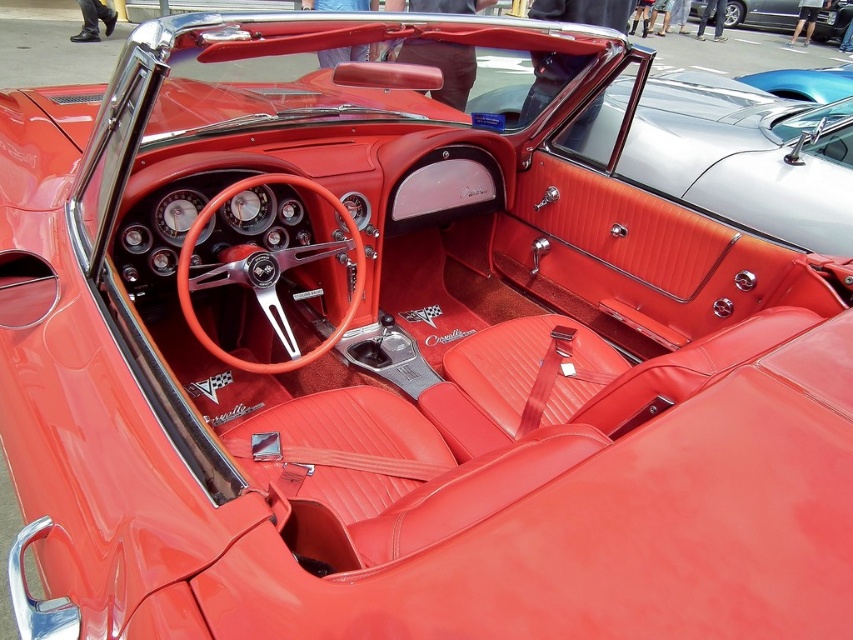
Question: Is matte red leather door at center closer to camera compared to glossy red leather convertible at upper center?

Choices:
 (A) no
 (B) yes

Answer: (B)

Question: Is matte red leather door at center below glossy red leather convertible at upper center?

Choices:
 (A) no
 (B) yes

Answer: (B)

Question: Which of the following is the closest to the observer?

Choices:
 (A) (849, 179)
 (B) (816, 29)

Answer: (A)

Question: Does matte red leather door at center lie behind glossy red leather convertible at upper center?

Choices:
 (A) no
 (B) yes

Answer: (A)

Question: Which object is closer to the camera taking this photo?

Choices:
 (A) matte red leather door at center
 (B) glossy red leather convertible at upper center

Answer: (A)